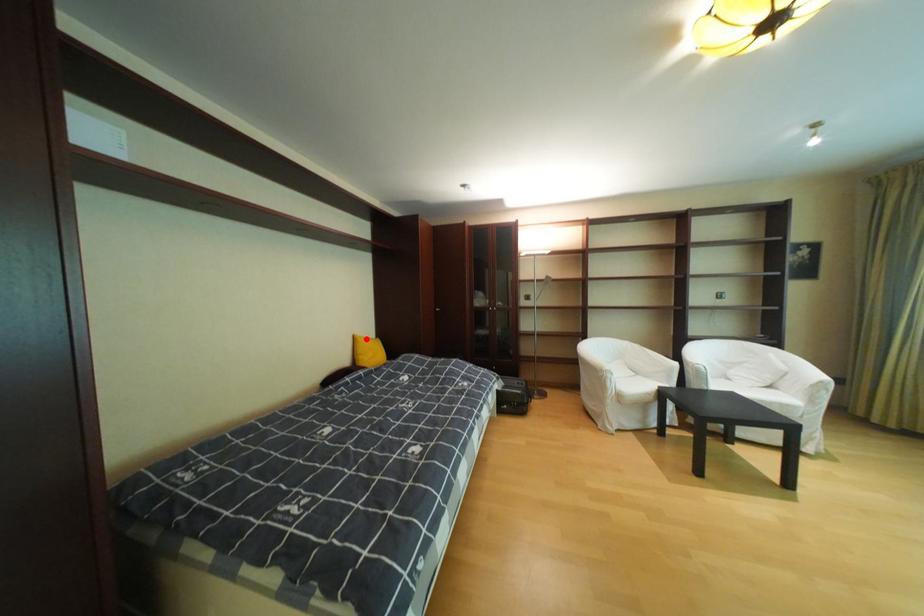
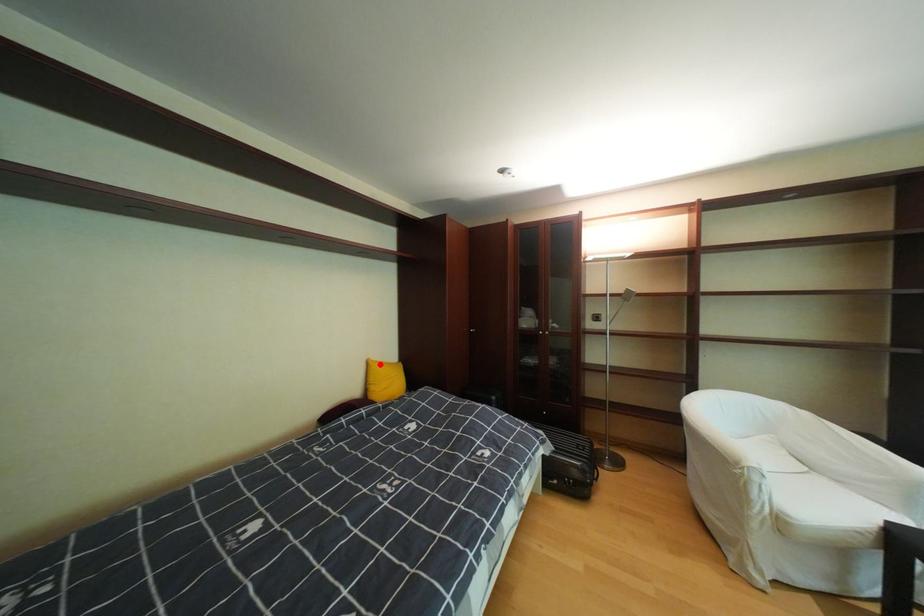
I am providing you with two images of the same scene from different viewpoints. A red point is marked on the first image and another point is marked on the second image. Are the points marked in image1 and image2 representing the same 3D position?

Yes